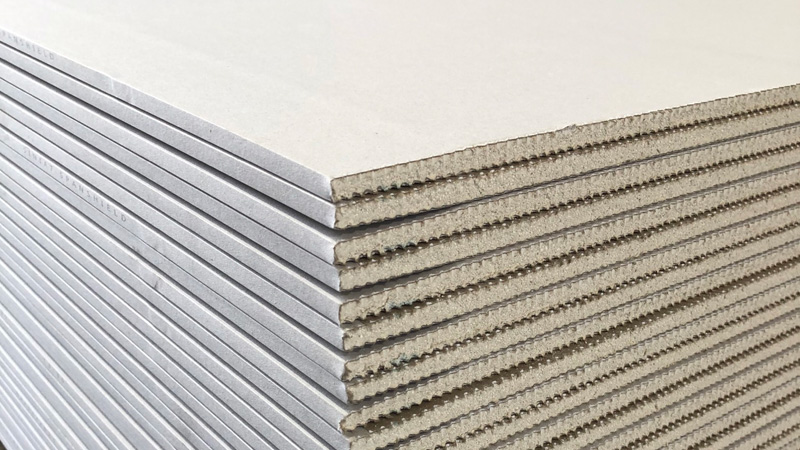
Where is `sheet #4`? The width and height of the screenshot is (800, 450). sheet #4 is located at coordinates (256, 236).